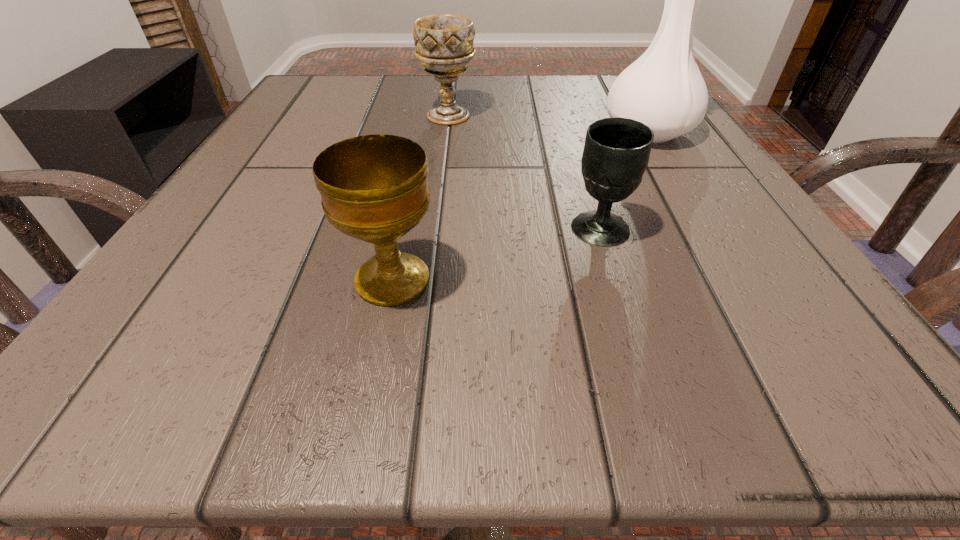
Identify which chalice is the nearest to the second farthest chalice. Please provide its 2D coordinates. Your answer should be formatted as a tuple, i.e. [(x, y)], where the tuple contains the x and y coordinates of a point satisfying the conditions above.

[(374, 188)]

Where is `vacant area that satisfies the following two spatial constraints: 1. on the back side of the third farthest object; 2. on the right side of the tallest object`? Image resolution: width=960 pixels, height=540 pixels. vacant area that satisfies the following two spatial constraints: 1. on the back side of the third farthest object; 2. on the right side of the tallest object is located at coordinates (569, 132).

What are the coordinates of `vacant point that satisfies the following two spatial constraints: 1. on the front side of the farthest chalice; 2. on the right side of the rightmost object` in the screenshot? It's located at (446, 132).